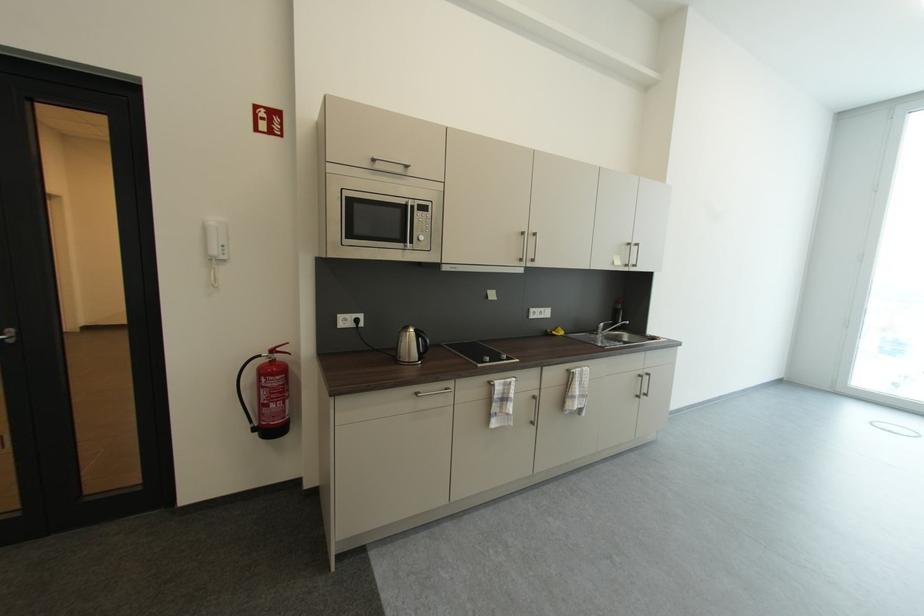
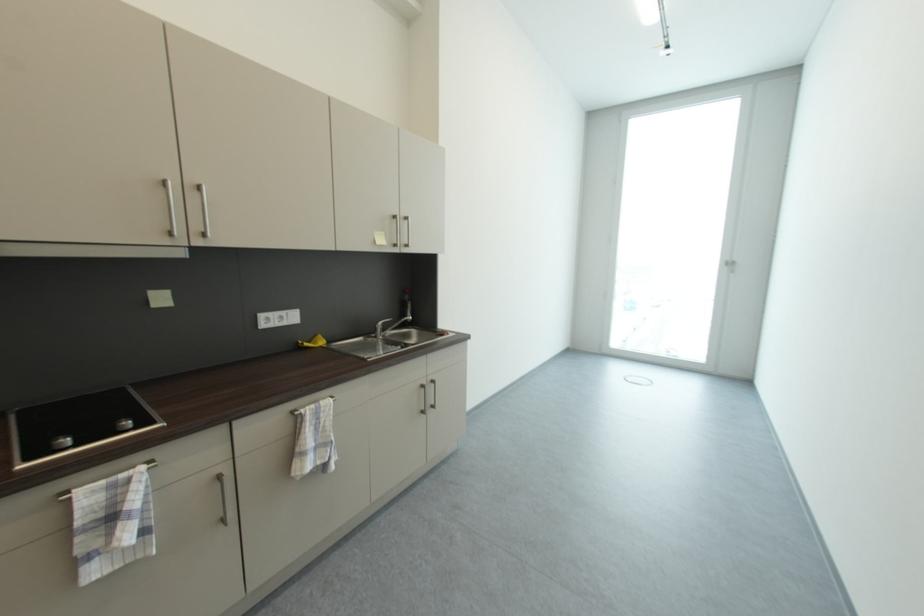
Question: The images are taken continuously from a first-person perspective. In which direction is your viewpoint rotating?

Choices:
 (A) Left
 (B) Right
 (C) Up
 (D) Down

Answer: (B)